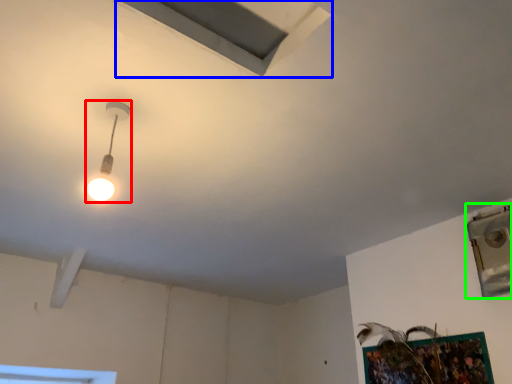
Question: Which object is positioned closest to lamp (highlighted by a red box)? Select from exhaust hood (highlighted by a blue box) and window (highlighted by a green box).

Choices:
 (A) exhaust hood
 (B) window

Answer: (A)